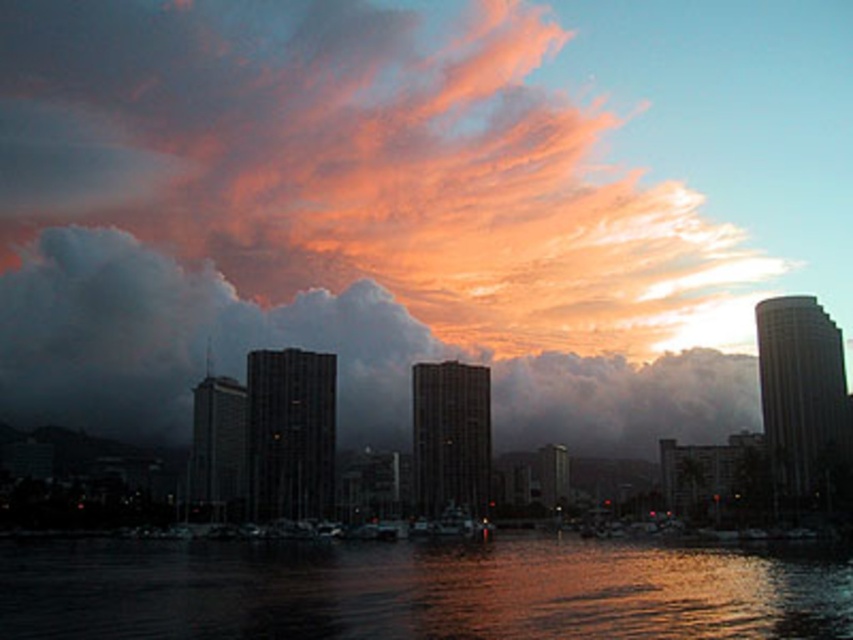
Can you confirm if cloudy sky at upper center is shorter than glistening dark water at lower center?

In fact, cloudy sky at upper center may be taller than glistening dark water at lower center.

The image size is (853, 640). What do you see at coordinates (183, 339) in the screenshot?
I see `cloudy sky at upper center` at bounding box center [183, 339].

From the picture: Who is more distant from viewer, (248, 301) or (529, 604)?

Point (248, 301)

Image resolution: width=853 pixels, height=640 pixels. Identify the location of cloudy sky at upper center. [x=183, y=339].

Can you confirm if orange cotton clouds at upper center is shorter than glistening dark water at lower center?

In fact, orange cotton clouds at upper center may be taller than glistening dark water at lower center.

Image resolution: width=853 pixels, height=640 pixels. Find the location of `orange cotton clouds at upper center`. orange cotton clouds at upper center is located at coordinates 354,164.

Is orange cotton clouds at upper center positioned before cloudy sky at upper center?

No.

Can you confirm if orange cotton clouds at upper center is positioned to the left of cloudy sky at upper center?

In fact, orange cotton clouds at upper center is to the right of cloudy sky at upper center.

Who is more forward, [466,100] or [80,236]?

Point [80,236] is more forward.

Locate an element on the screen. The image size is (853, 640). orange cotton clouds at upper center is located at coordinates (354, 164).